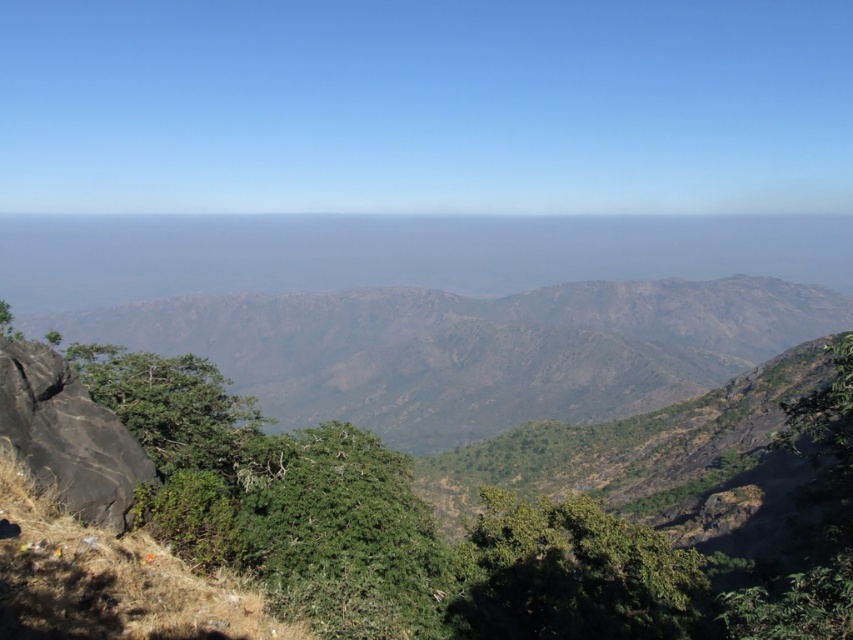
Does point (495, 381) lie in front of point (73, 394)?

That is False.

Does brown rocky mountain at left have a larger size compared to black rock at left?

Yes, brown rocky mountain at left is bigger than black rock at left.

Which is in front, point (628, 317) or point (0, 339)?

Point (0, 339) is more forward.

You are a GUI agent. You are given a task and a screenshot of the screen. Output one action in this format:
    pyautogui.click(x=<x>, y=<y>)
    Task: Click on the brown rocky mountain at left
    
    Given the screenshot: What is the action you would take?
    pyautogui.click(x=473, y=348)